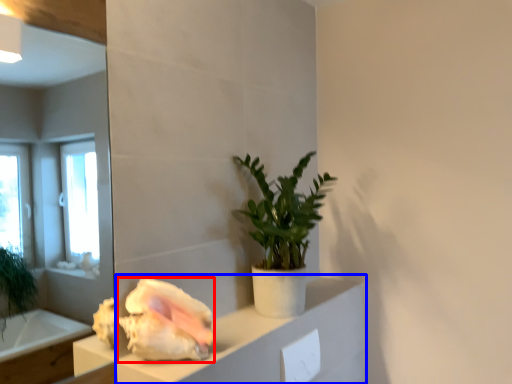
Question: Among these objects, which one is farthest to the camera, flower (highlighted by a red box) or cabinetry (highlighted by a blue box)?

Choices:
 (A) flower
 (B) cabinetry

Answer: (A)